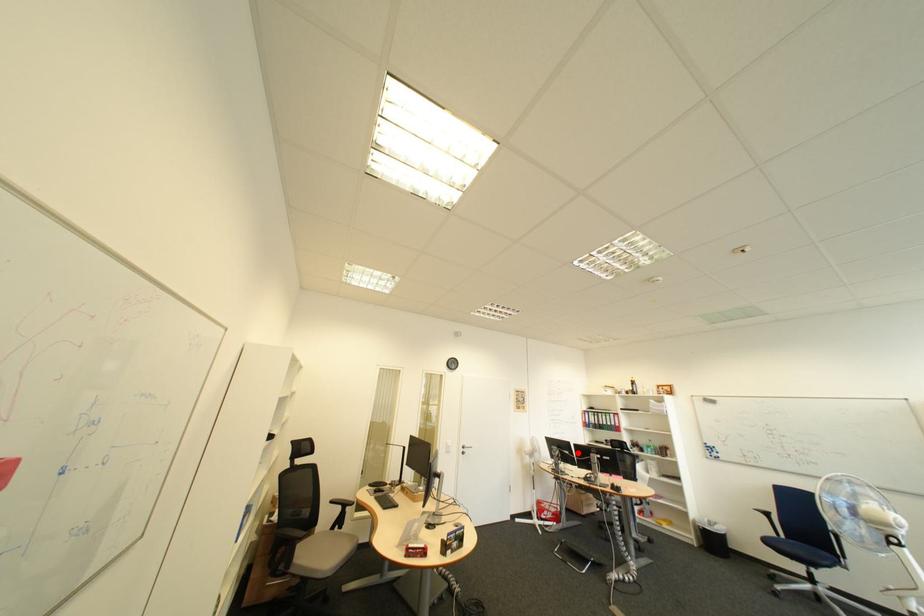
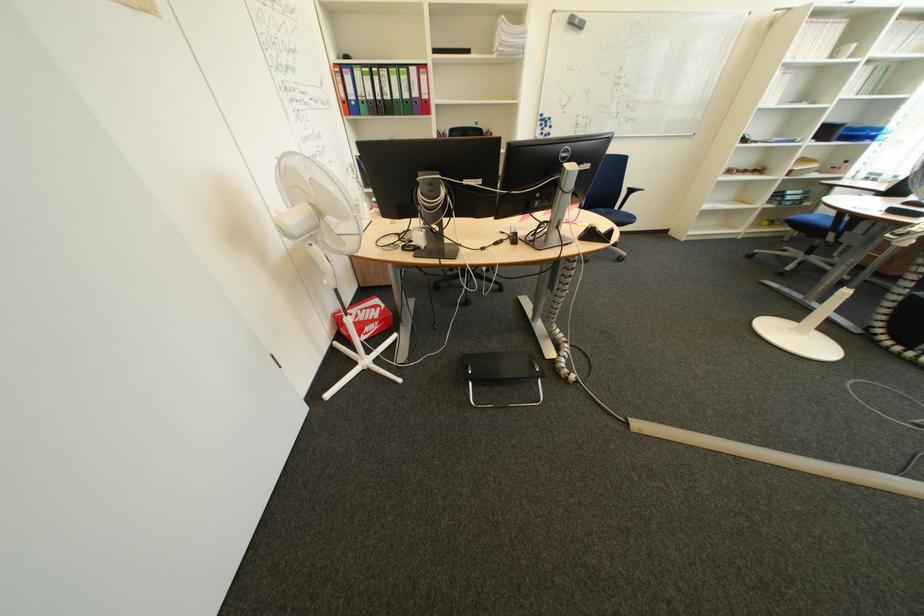
Question: I am providing you with two images of the same scene from different viewpoints. A red point is shown in image1. For the corresponding object point in image2, is it positioned nearer or farther from the camera?

Choices:
 (A) Nearer
 (B) Farther

Answer: (A)